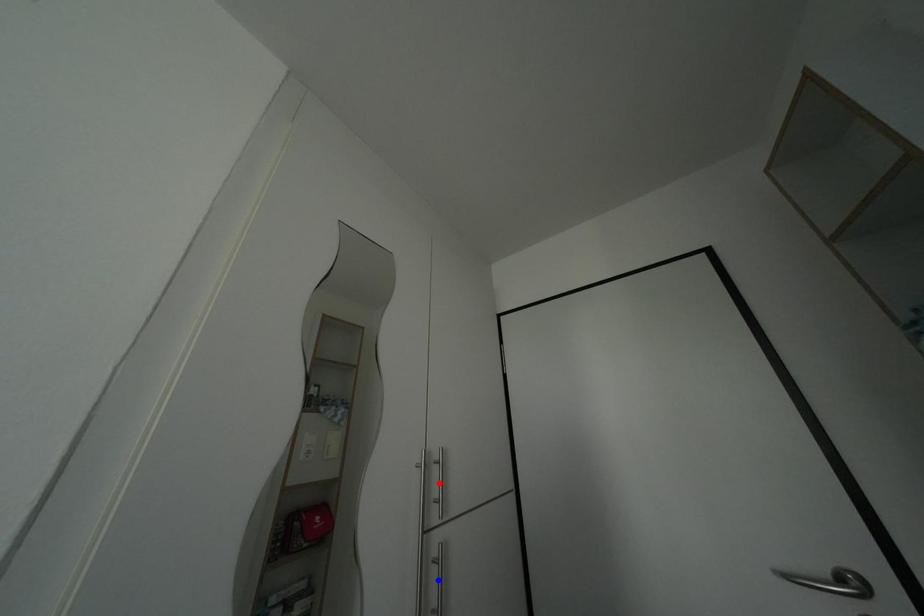
Question: In the image, two points are highlighted. Which point is nearer to the camera? Reply with the corresponding letter.

Choices:
 (A) blue point
 (B) red point

Answer: (A)